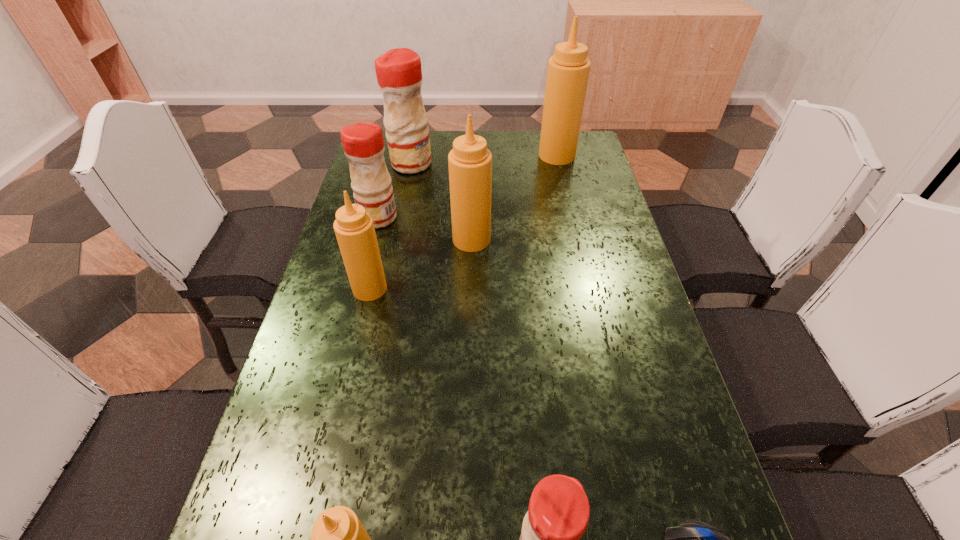
Locate an element on the screen. The width and height of the screenshot is (960, 540). the tallest object is located at coordinates (568, 70).

At what (x,y) coordinates should I click in order to perform the action: click on the biggest tan condiment. Please return your answer as a coordinate pair (x, y). This screenshot has width=960, height=540. Looking at the image, I should click on (568, 70).

This screenshot has height=540, width=960. Identify the location of the farthest red condiment. (398, 71).

Locate an element on the screen. The width and height of the screenshot is (960, 540). the second farthest tan condiment is located at coordinates (470, 162).

Where is `the fifth object from left to right`? This screenshot has width=960, height=540. the fifth object from left to right is located at coordinates (470, 162).

I want to click on the third nearest condiment, so click(x=354, y=228).

You are a GUI agent. You are given a task and a screenshot of the screen. Output one action in this format:
    pyautogui.click(x=<x>, y=<y>)
    Task: Click on the fifth farthest object
    
    Given the screenshot: What is the action you would take?
    point(354,228)

In order to click on the second biggest red condiment in this screenshot , I will do `click(363, 144)`.

Image resolution: width=960 pixels, height=540 pixels. Find the location of `vacant area located on the front of the rightmost tan condiment`. vacant area located on the front of the rightmost tan condiment is located at coordinates (573, 226).

Image resolution: width=960 pixels, height=540 pixels. Identify the location of vacant space located on the front of the biggest red condiment. (393, 254).